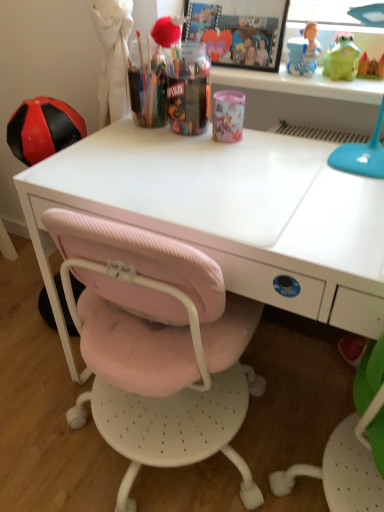
Question: From a real-world perspective, is green rubber frog at upper right, the 2th toy positioned from the right, physically below translucent plastic container at center, arranged as the 1th stationery when viewed from the left?

Choices:
 (A) yes
 (B) no

Answer: (B)

Question: Considering the relative sizes of green rubber frog at upper right, arranged as the first toy when viewed from the left, and translucent plastic container at center, arranged as the 1th stationery when viewed from the left, in the image provided, is green rubber frog at upper right, arranged as the first toy when viewed from the left, smaller than translucent plastic container at center, arranged as the 1th stationery when viewed from the left,?

Choices:
 (A) yes
 (B) no

Answer: (A)

Question: From the image's perspective, does green rubber frog at upper right, the 2th toy positioned from the right, appear lower than translucent plastic container at center, arranged as the 1th stationery when viewed from the left?

Choices:
 (A) no
 (B) yes

Answer: (A)

Question: Is green rubber frog at upper right, arranged as the first toy when viewed from the left, positioned far away from translucent plastic container at center, arranged as the 1th stationery when viewed from the left?

Choices:
 (A) yes
 (B) no

Answer: (B)

Question: Is green rubber frog at upper right, the 2th toy positioned from the right, positioned with its back to translucent plastic container at center, arranged as the 1th stationery when viewed from the left?

Choices:
 (A) yes
 (B) no

Answer: (B)

Question: In terms of width, does translucent plastic container at center, the 2th stationery in the right-to-left sequence, look wider or thinner when compared to green rubber frog at upper right, arranged as the first toy when viewed from the left?

Choices:
 (A) thin
 (B) wide

Answer: (B)

Question: Is translucent plastic container at center, arranged as the 1th stationery when viewed from the left, inside the boundaries of green rubber frog at upper right, the 2th toy positioned from the right, or outside?

Choices:
 (A) inside
 (B) outside

Answer: (B)

Question: Considering the positions of translucent plastic container at center, arranged as the 1th stationery when viewed from the left, and green rubber frog at upper right, arranged as the first toy when viewed from the left, in the image, is translucent plastic container at center, arranged as the 1th stationery when viewed from the left, taller or shorter than green rubber frog at upper right, arranged as the first toy when viewed from the left,?

Choices:
 (A) short
 (B) tall

Answer: (B)

Question: Considering the relative positions of translucent plastic container at center, arranged as the 1th stationery when viewed from the left, and green rubber frog at upper right, arranged as the first toy when viewed from the left, in the image provided, is translucent plastic container at center, arranged as the 1th stationery when viewed from the left, to the left or to the right of green rubber frog at upper right, arranged as the first toy when viewed from the left,?

Choices:
 (A) left
 (B) right

Answer: (A)

Question: Considering the relative positions of matte green toy at upper right, which appears as the first toy when viewed from the right, and green rubber frog at upper right, arranged as the first toy when viewed from the left, in the image provided, is matte green toy at upper right, which appears as the first toy when viewed from the right, to the left or to the right of green rubber frog at upper right, arranged as the first toy when viewed from the left,?

Choices:
 (A) right
 (B) left

Answer: (A)

Question: From the image's perspective, is matte green toy at upper right, arranged as the second toy when viewed from the left, positioned above or below green rubber frog at upper right, arranged as the first toy when viewed from the left?

Choices:
 (A) above
 (B) below

Answer: (B)

Question: Based on their sizes in the image, would you say matte green toy at upper right, arranged as the second toy when viewed from the left, is bigger or smaller than green rubber frog at upper right, arranged as the first toy when viewed from the left?

Choices:
 (A) big
 (B) small

Answer: (B)

Question: Do you think matte green toy at upper right, which appears as the first toy when viewed from the right, is within green rubber frog at upper right, the 2th toy positioned from the right, or outside of it?

Choices:
 (A) outside
 (B) inside

Answer: (A)

Question: In terms of height, does matte green toy at upper right, arranged as the second toy when viewed from the left, look taller or shorter compared to white matte desk at center?

Choices:
 (A) short
 (B) tall

Answer: (A)

Question: In terms of width, does matte green toy at upper right, which appears as the first toy when viewed from the right, look wider or thinner when compared to white matte desk at center?

Choices:
 (A) wide
 (B) thin

Answer: (B)